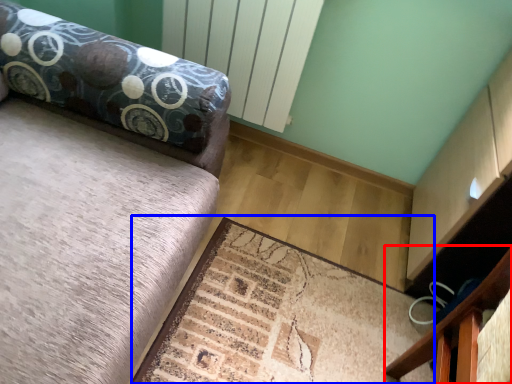
Question: Which of the following is the closest to the observer, furniture (highlighted by a red box) or mat (highlighted by a blue box)?

Choices:
 (A) furniture
 (B) mat

Answer: (B)